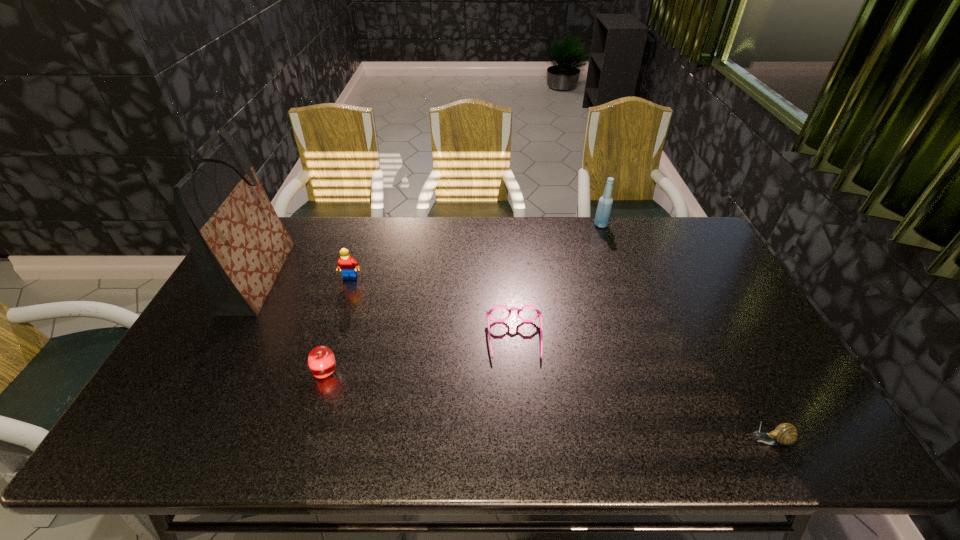
Locate which object is the fourth closest to the leftmost object. Please provide its 2D coordinates. Your answer should be formatted as a tuple, i.e. [(x, y)], where the tuple contains the x and y coordinates of a point satisfying the conditions above.

[(603, 212)]

Locate which object ranks third in proximity to the leftmost object. Please provide its 2D coordinates. Your answer should be formatted as a tuple, i.e. [(x, y)], where the tuple contains the x and y coordinates of a point satisfying the conditions above.

[(488, 313)]

Image resolution: width=960 pixels, height=540 pixels. I want to click on vacant space that satisfies the following two spatial constraints: 1. on the back side of the apple; 2. on the front-facing side of the leftmost object, so pos(355,277).